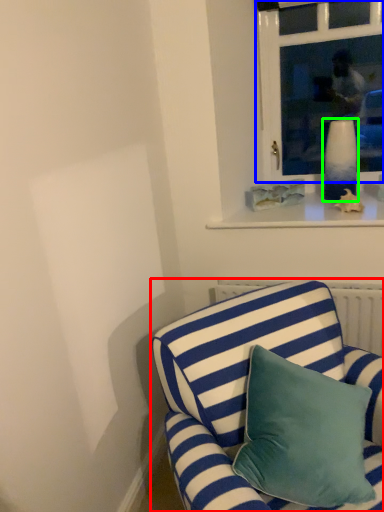
Question: Which object is positioned farthest from studio couch (highlighted by a red box)? Select from window (highlighted by a blue box) and vase (highlighted by a green box).

Choices:
 (A) window
 (B) vase

Answer: (A)